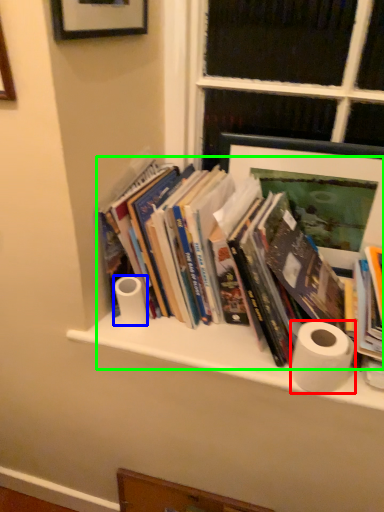
Question: Estimate the real-world distances between objects in this image. Which object is farther from toilet paper (highlighted by a red box), toilet paper (highlighted by a blue box) or book (highlighted by a green box)?

Choices:
 (A) toilet paper
 (B) book

Answer: (A)